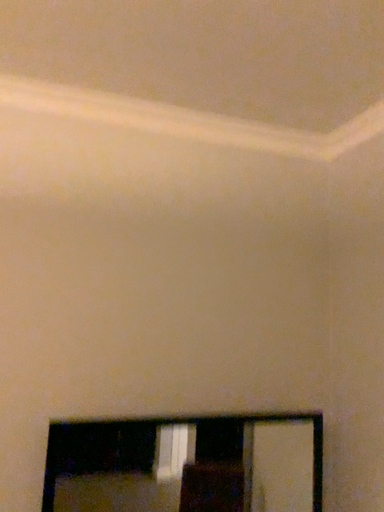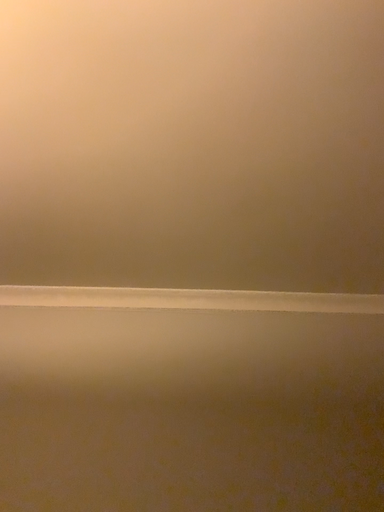
Question: How did the camera likely rotate when shooting the video?

Choices:
 (A) rotated left
 (B) rotated right

Answer: (A)